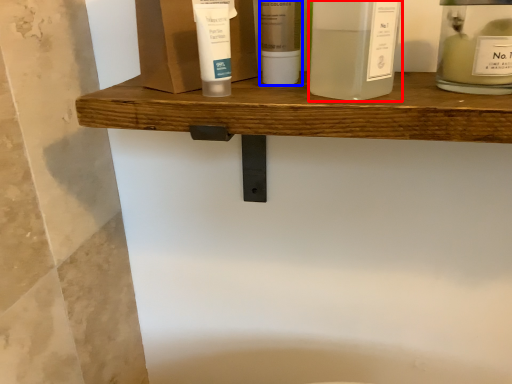
Question: Which point is further to the camera, product (highlighted by a red box) or toiletry (highlighted by a blue box)?

Choices:
 (A) product
 (B) toiletry

Answer: (B)